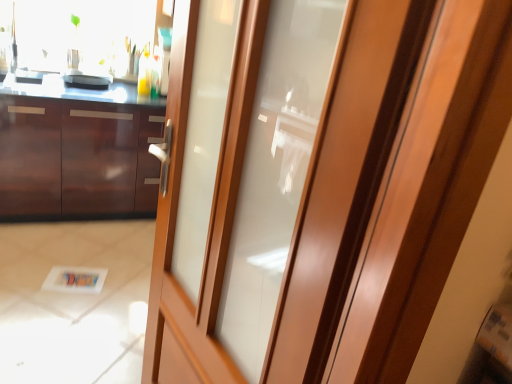
Question: Is matte wood door at center aimed at glossy wood cabinetry at left?

Choices:
 (A) yes
 (B) no

Answer: (B)

Question: From the image's perspective, is matte wood door at center above glossy wood cabinetry at left?

Choices:
 (A) no
 (B) yes

Answer: (A)

Question: Is matte wood door at center smaller than glossy wood cabinetry at left?

Choices:
 (A) yes
 (B) no

Answer: (A)

Question: Is matte wood door at center positioned with its back to glossy wood cabinetry at left?

Choices:
 (A) yes
 (B) no

Answer: (B)

Question: Are matte wood door at center and glossy wood cabinetry at left far apart?

Choices:
 (A) no
 (B) yes

Answer: (B)

Question: Is matte wood door at center taller than glossy wood cabinetry at left?

Choices:
 (A) no
 (B) yes

Answer: (B)

Question: From a real-world perspective, is glossy wood cabinetry at left beneath matte wood door at center?

Choices:
 (A) yes
 (B) no

Answer: (A)

Question: Are glossy wood cabinetry at left and matte wood door at center making contact?

Choices:
 (A) no
 (B) yes

Answer: (A)

Question: Is glossy wood cabinetry at left far away from matte wood door at center?

Choices:
 (A) no
 (B) yes

Answer: (B)

Question: Does glossy wood cabinetry at left have a lesser height compared to matte wood door at center?

Choices:
 (A) no
 (B) yes

Answer: (B)

Question: Considering the relative sizes of glossy wood cabinetry at left and matte wood door at center in the image provided, is glossy wood cabinetry at left thinner than matte wood door at center?

Choices:
 (A) no
 (B) yes

Answer: (A)

Question: Can you confirm if glossy wood cabinetry at left is wider than matte wood door at center?

Choices:
 (A) no
 (B) yes

Answer: (B)

Question: Is glossy wood cabinetry at left not within matte black pan at upper left?

Choices:
 (A) no
 (B) yes

Answer: (B)